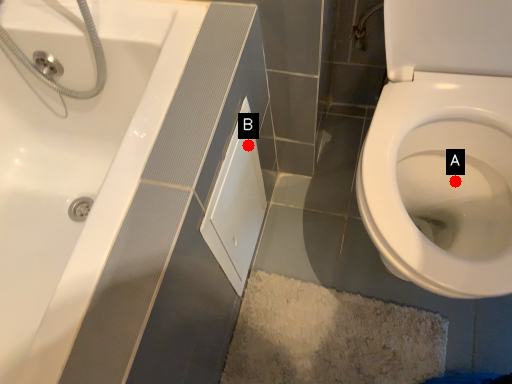
Question: Two points are circled on the image, labeled by A and B beside each circle. Which point appears closest to the camera in this image?

Choices:
 (A) A is closer
 (B) B is closer

Answer: (B)